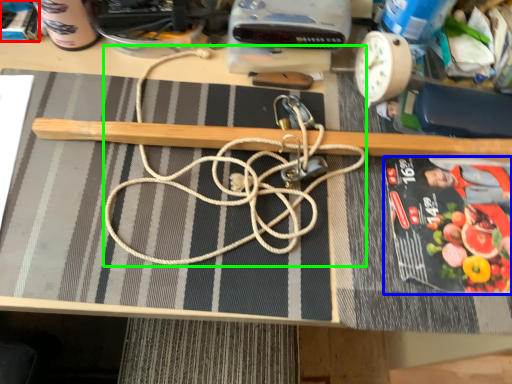
Question: Based on their relative distances, which object is farther from paperback book (highlighted by a red box)? Choose from paperback book (highlighted by a blue box) and string (highlighted by a green box).

Choices:
 (A) paperback book
 (B) string

Answer: (A)